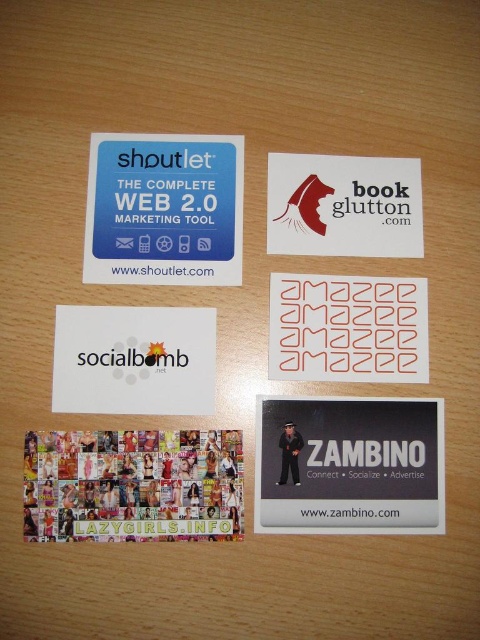
You are organizing a business card display and have two items to place next to each other on the table. The white paper at center and the white matte business card at upper center. Which one is shorter in height?

The white paper at center has a lesser height compared to the white matte business card at upper center, so it is shorter.

Which object is closer to the top edge of the image, the multicolored collage at center or the blue square sticker at top left?

The blue square sticker at top left is closer to the top edge of the image because it is positioned at the top left corner, while the multicolored collage at center is located lower down at coordinates point [132,484].

Which object is taller between the black matte postcard at lower right and the red matte stickers at center?

The black matte postcard at lower right is taller than the red matte stickers at center.